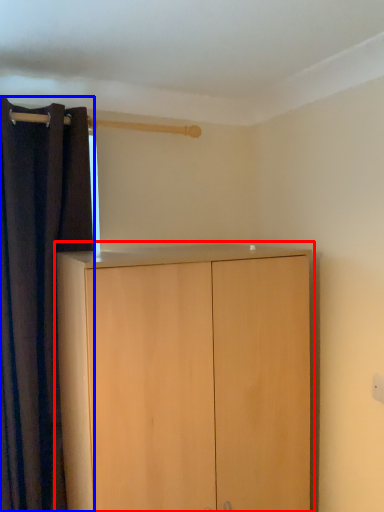
Question: Which object is closer to the camera taking this photo, cupboard (highlighted by a red box) or curtain (highlighted by a blue box)?

Choices:
 (A) cupboard
 (B) curtain

Answer: (A)